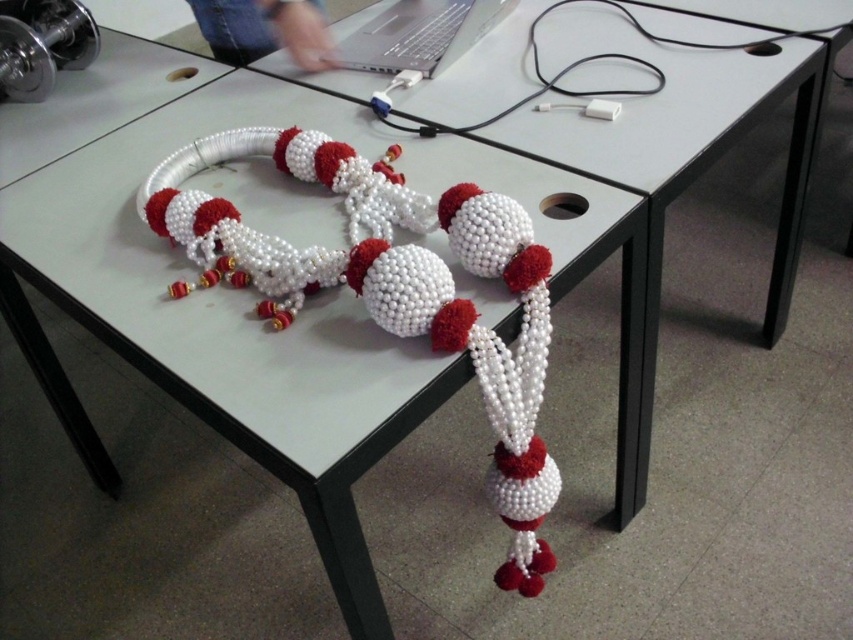
Question: Which point is farther to the camera?

Choices:
 (A) (651, 88)
 (B) (416, 45)

Answer: (B)

Question: Is silver metallic laptop at upper center positioned behind white matte cable at upper center?

Choices:
 (A) no
 (B) yes

Answer: (B)

Question: Is silver metallic laptop at upper center to the left of white matte cable at upper center from the viewer's perspective?

Choices:
 (A) yes
 (B) no

Answer: (A)

Question: In this image, where is silver metallic laptop at upper center located relative to white matte cable at upper center?

Choices:
 (A) left
 (B) right

Answer: (A)